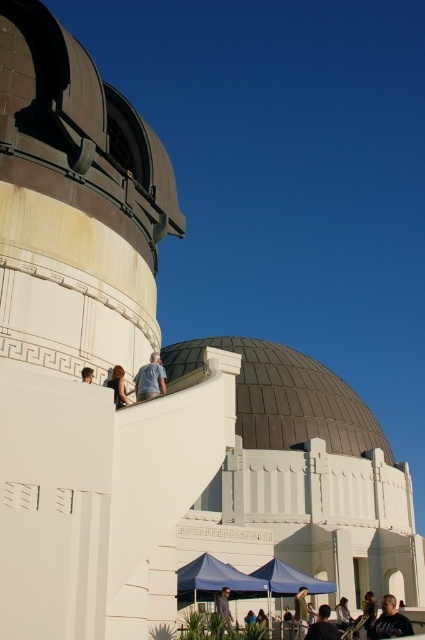
Question: Estimate the real-world distances between objects in this image. Which object is farther from the dark brown leather jacket at lower center?

Choices:
 (A) light brown leather jacket at center
 (B) dark blue shirt at center
 (C) light blue denim jeans at upper center
 (D) light brown hair at upper center

Answer: (D)

Question: Which object appears farthest from the camera in this image?

Choices:
 (A) light brown leather jacket at center
 (B) dark blue shirt at center
 (C) dark brown leather jacket at lower right
 (D) light brown hair at upper center

Answer: (A)

Question: Is light blue denim jeans at upper center behind dark blue shirt at center?

Choices:
 (A) yes
 (B) no

Answer: (B)

Question: Which object appears closest to the camera in this image?

Choices:
 (A) light blue denim jeans at upper center
 (B) dark brown leather jacket at lower center
 (C) light brown leather jacket at center

Answer: (A)

Question: Can you confirm if light blue denim jeans at upper center is positioned below light brown hair at upper center?

Choices:
 (A) yes
 (B) no

Answer: (B)

Question: Is light brown leather jacket at center bigger than light brown hair at upper center?

Choices:
 (A) no
 (B) yes

Answer: (B)